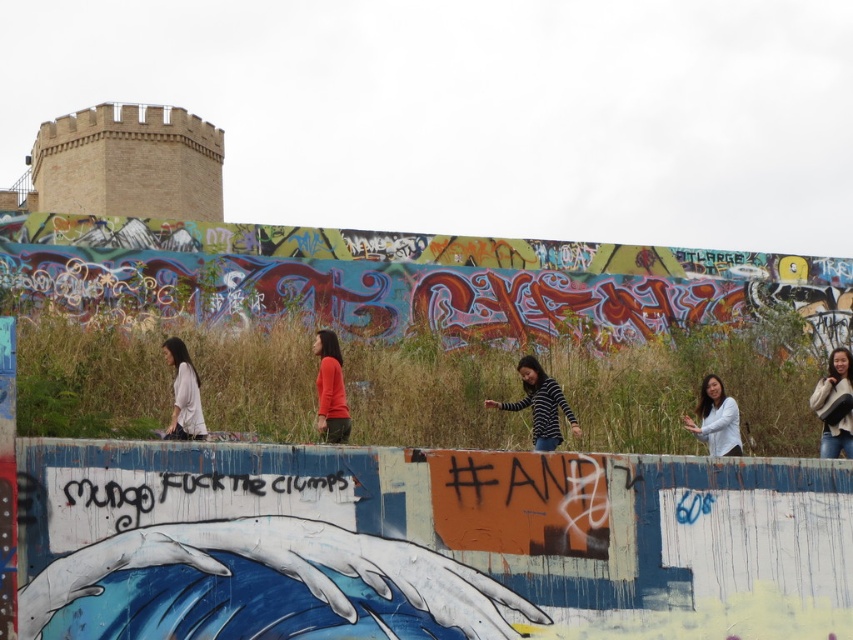
Question: Which point is farther to the camera?

Choices:
 (A) striped sweater at center
 (B) white matte shirt at lower right
 (C) white sweater at upper right

Answer: (A)

Question: Does matte orange sweater at center come behind white matte shirt at lower right?

Choices:
 (A) yes
 (B) no

Answer: (B)

Question: Is striped sweater at center further to camera compared to matte orange sweater at center?

Choices:
 (A) no
 (B) yes

Answer: (B)

Question: Is striped sweater at center bigger than matte orange sweater at center?

Choices:
 (A) no
 (B) yes

Answer: (A)

Question: Which object is the closest to the striped sweater at center?

Choices:
 (A) light beige fabric shirt at left
 (B) matte orange sweater at center
 (C) white sweater at upper right
 (D) white matte shirt at lower right

Answer: (D)

Question: Which point is farther to the camera?

Choices:
 (A) (546, 380)
 (B) (329, 426)
 (C) (715, 387)
 (D) (186, 416)

Answer: (C)